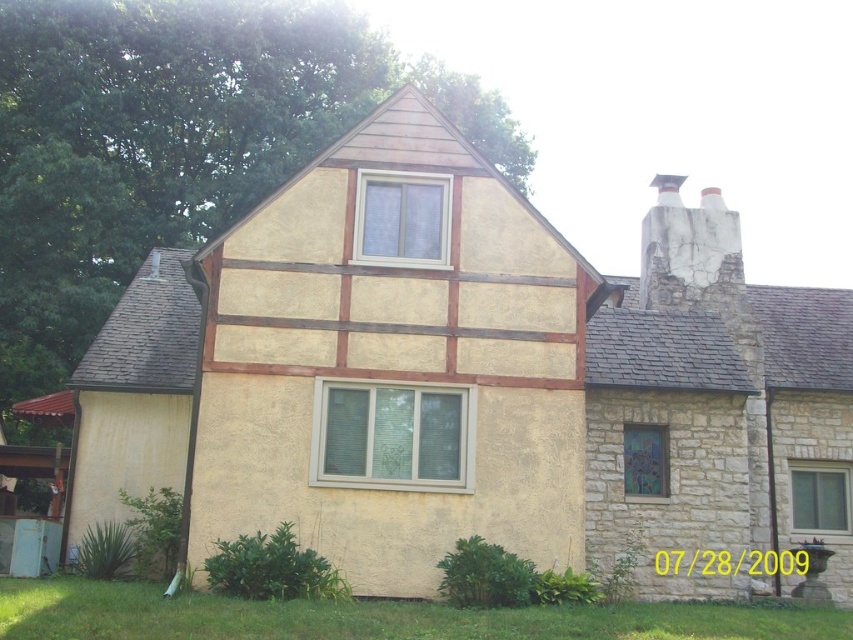
You are standing in front of the house and want to walk towards the clear glass window at center. Which direction should you move relative to the green grass at lower left?

Since the green grass at lower left is closer to the viewer than the clear glass window at center, you should move towards the direction away from the green grass at lower left to reach the clear glass window at center.